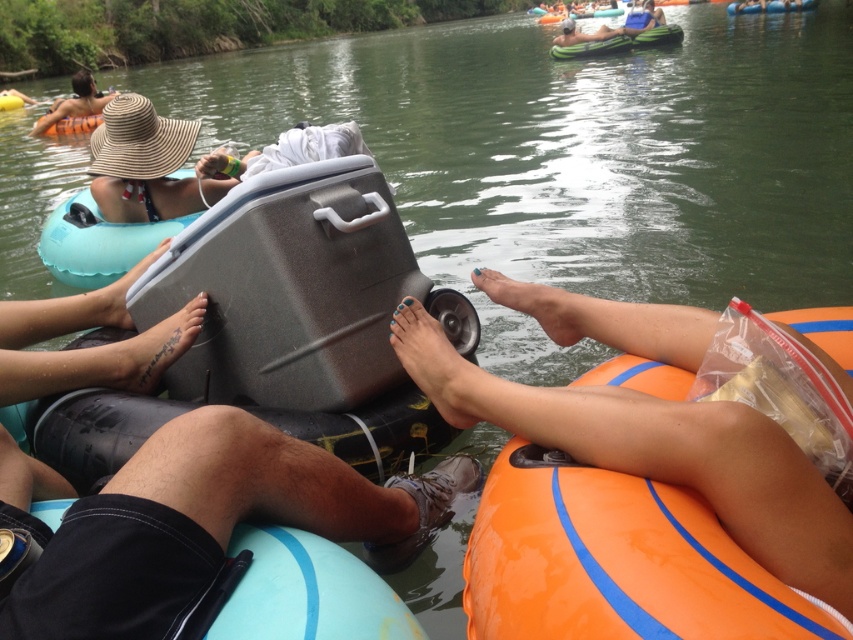
You are a photographer trying to capture a shot of the gray plastic cooler at center and the straw hat at upper left. From your current position, which object should you adjust your camera to focus on first if you want to frame them both in a left to right order?

The straw hat at upper left should be focused on first since it is positioned to the left of the gray plastic cooler at center, allowing you to frame them in left to right order.

You are a photographer trying to capture a photo of the smooth orange tube at lower right and the matte gray cooler at upper center. To ensure both are in frame, where should you position your camera relative to the scene?

Position your camera above the scene so that it can capture both the smooth orange tube at lower right, which is located below the matte gray cooler at upper center, ensuring both are within the frame.